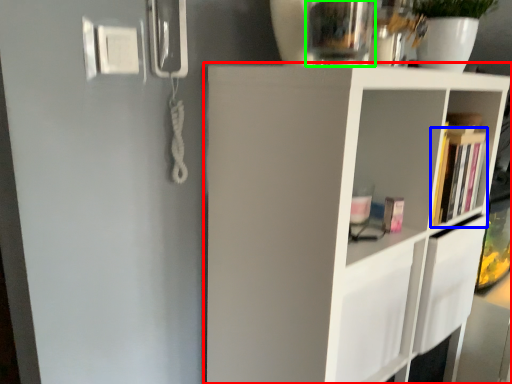
Question: Considering the real-world distances, which object is farthest from shelf (highlighted by a red box)? book (highlighted by a blue box) or glass vase (highlighted by a green box)?

Choices:
 (A) book
 (B) glass vase

Answer: (B)